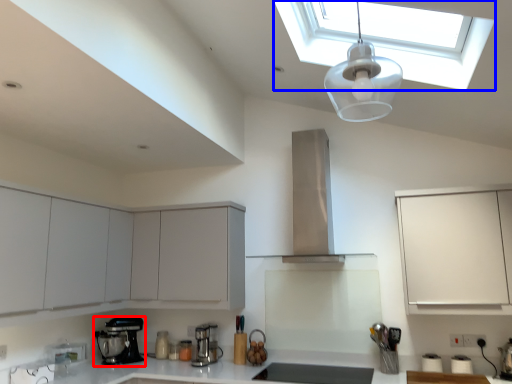
Question: Which of the following is the farthest to the observer, kitchen appliance (highlighted by a red box) or window (highlighted by a blue box)?

Choices:
 (A) kitchen appliance
 (B) window

Answer: (A)